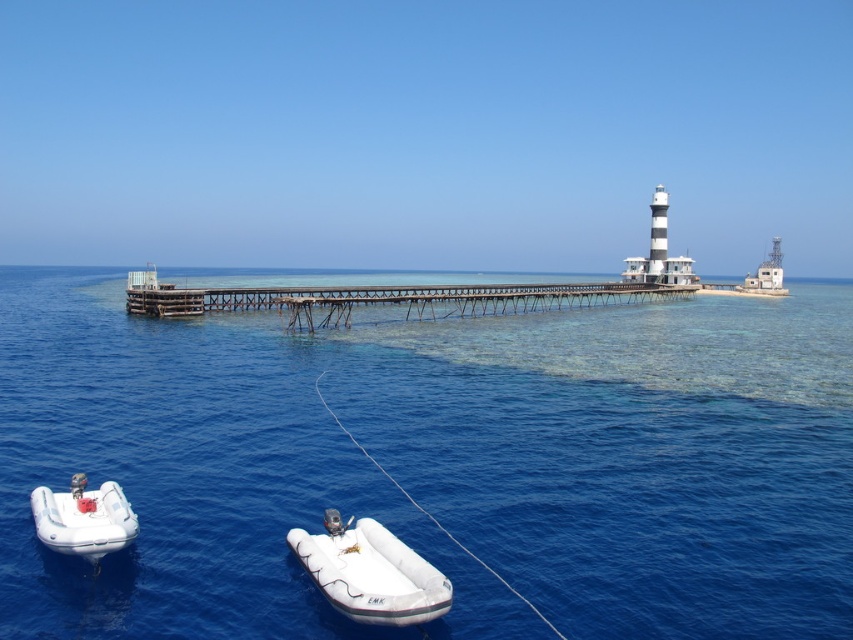
Question: Can you confirm if white rubber boat at lower center is positioned to the right of white rubber dinghy at lower left?

Choices:
 (A) no
 (B) yes

Answer: (B)

Question: Can you confirm if blue clear water at center is positioned to the right of white rubber dinghy at lower left?

Choices:
 (A) yes
 (B) no

Answer: (B)

Question: In this image, where is rusty metal dock at center located relative to white rubber dinghy at lower left?

Choices:
 (A) below
 (B) above

Answer: (B)

Question: Which is farther from the white rubber boat at lower center?

Choices:
 (A) rusty metal dock at center
 (B) blue clear water at center
 (C) white rubber dinghy at lower left

Answer: (A)

Question: Which object appears farthest from the camera in this image?

Choices:
 (A) rusty metal dock at center
 (B) white rubber dinghy at lower left
 (C) blue clear water at center

Answer: (A)

Question: Which of the following is the farthest from the observer?

Choices:
 (A) click(x=791, y=440)
 (B) click(x=376, y=618)

Answer: (A)